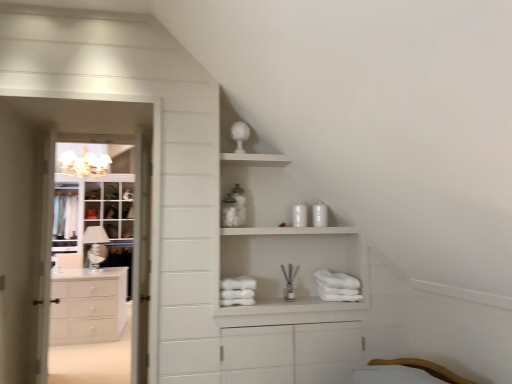
Question: Is white glass cabinet at left looking in the opposite direction of matte white chandelier at upper left?

Choices:
 (A) yes
 (B) no

Answer: (B)

Question: Is the surface of white glass cabinet at left in direct contact with matte white chandelier at upper left?

Choices:
 (A) yes
 (B) no

Answer: (B)

Question: Is the depth of white glass cabinet at left greater than that of matte white chandelier at upper left?

Choices:
 (A) yes
 (B) no

Answer: (A)

Question: From a real-world perspective, is white glass cabinet at left below matte white chandelier at upper left?

Choices:
 (A) no
 (B) yes

Answer: (B)

Question: Could matte white chandelier at upper left be considered to be inside white glass cabinet at left?

Choices:
 (A) yes
 (B) no

Answer: (B)

Question: Is white glass cabinet at left not within matte white chandelier at upper left?

Choices:
 (A) no
 (B) yes

Answer: (B)

Question: From a real-world perspective, is white matte cabinet at upper center below clear glass lamp at left?

Choices:
 (A) yes
 (B) no

Answer: (B)

Question: Is clear glass lamp at left located within white matte cabinet at upper center?

Choices:
 (A) no
 (B) yes

Answer: (A)

Question: From the image's perspective, is white matte cabinet at upper center below clear glass lamp at left?

Choices:
 (A) yes
 (B) no

Answer: (B)

Question: From a real-world perspective, is white matte cabinet at upper center over clear glass lamp at left?

Choices:
 (A) yes
 (B) no

Answer: (A)

Question: Does white matte cabinet at upper center have a greater height compared to clear glass lamp at left?

Choices:
 (A) no
 (B) yes

Answer: (B)

Question: Is white matte cabinet at upper center thinner than clear glass lamp at left?

Choices:
 (A) yes
 (B) no

Answer: (B)

Question: Is white wood door at left placed right next to white glossy cabinet at left?

Choices:
 (A) no
 (B) yes

Answer: (A)